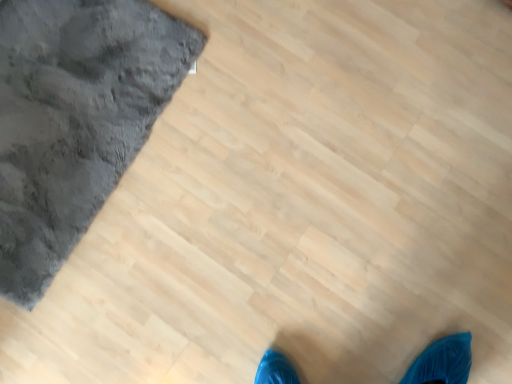
This screenshot has width=512, height=384. What do you see at coordinates (75, 119) in the screenshot? I see `dark gray plush bath mat at upper left` at bounding box center [75, 119].

Identify the location of dark gray plush bath mat at upper left. This screenshot has width=512, height=384. (75, 119).

The height and width of the screenshot is (384, 512). Find the location of `dark gray plush bath mat at upper left`. dark gray plush bath mat at upper left is located at coordinates (75, 119).